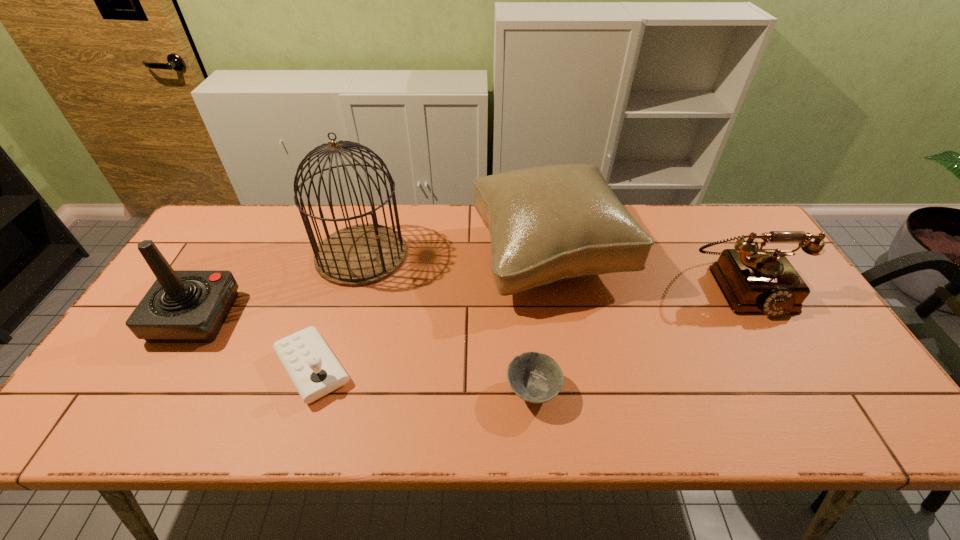
Locate an element on the screen. Image resolution: width=960 pixels, height=540 pixels. the tallest object is located at coordinates (363, 254).

Image resolution: width=960 pixels, height=540 pixels. What are the coordinates of `cushion` in the screenshot? It's located at (547, 223).

Image resolution: width=960 pixels, height=540 pixels. I want to click on the leftmost object, so click(x=182, y=306).

Find the location of a particular element. The width and height of the screenshot is (960, 540). the taller joystick is located at coordinates (182, 306).

Image resolution: width=960 pixels, height=540 pixels. Find the location of `the third shortest object`. the third shortest object is located at coordinates (753, 281).

Where is `the rightmost object`? The height and width of the screenshot is (540, 960). the rightmost object is located at coordinates (753, 281).

Where is `the fifth tallest object`? the fifth tallest object is located at coordinates (314, 370).

At what (x,y) coordinates should I click in order to perform the action: click on the right joystick. Please return your answer as a coordinate pair (x, y). The height and width of the screenshot is (540, 960). Looking at the image, I should click on (314, 370).

The width and height of the screenshot is (960, 540). In order to click on the shortest object in this screenshot , I will do `click(536, 378)`.

This screenshot has height=540, width=960. Find the location of `free space located 0.360m at the door of the tallest object`. free space located 0.360m at the door of the tallest object is located at coordinates (524, 255).